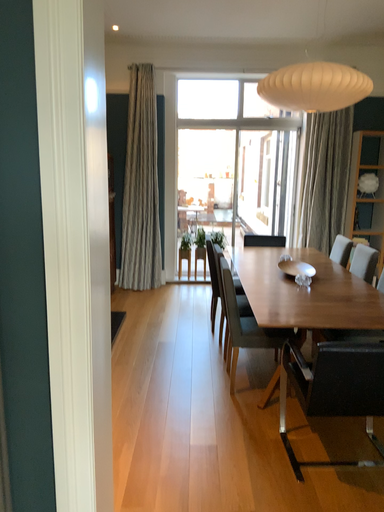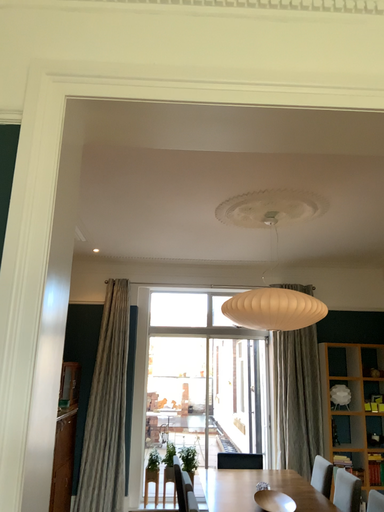
Question: Which way did the camera rotate in the video?

Choices:
 (A) rotated downward
 (B) rotated upward

Answer: (B)